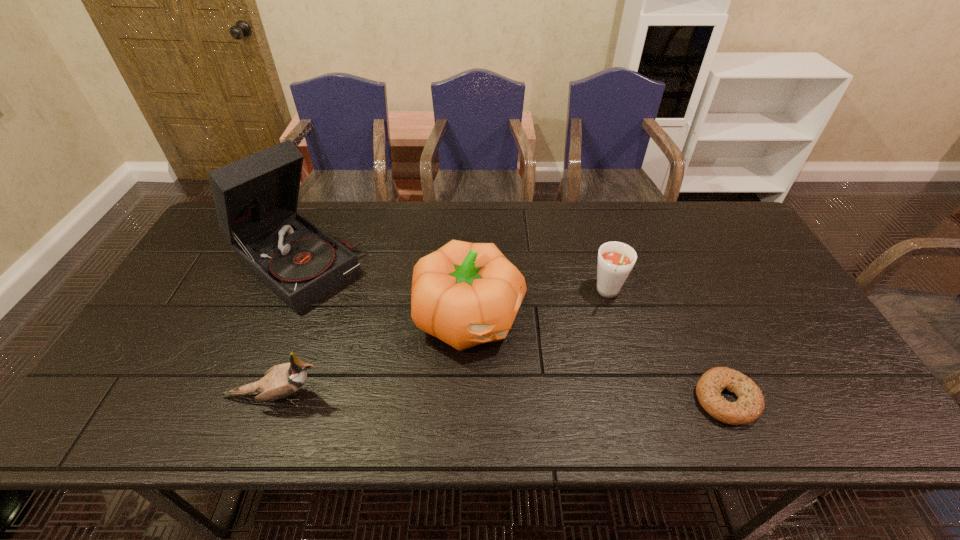
At what (x,y) coordinates should I click in order to perform the action: click on vacant space on the desktop that is between the bird and the bagel and is positioned on the carved face of the third object from left to right. Please return your answer as a coordinate pair (x, y). Image resolution: width=960 pixels, height=540 pixels. Looking at the image, I should click on (567, 399).

Where is `free space on the desktop that is between the bird and the rightmost object and is positioned on the front-facing side of the tallest object`? The height and width of the screenshot is (540, 960). free space on the desktop that is between the bird and the rightmost object and is positioned on the front-facing side of the tallest object is located at coordinates (459, 397).

What are the coordinates of `vacant spot on the desktop that is between the bird and the rightmost object and is positioned on the drink side of the root beer` in the screenshot? It's located at (566, 399).